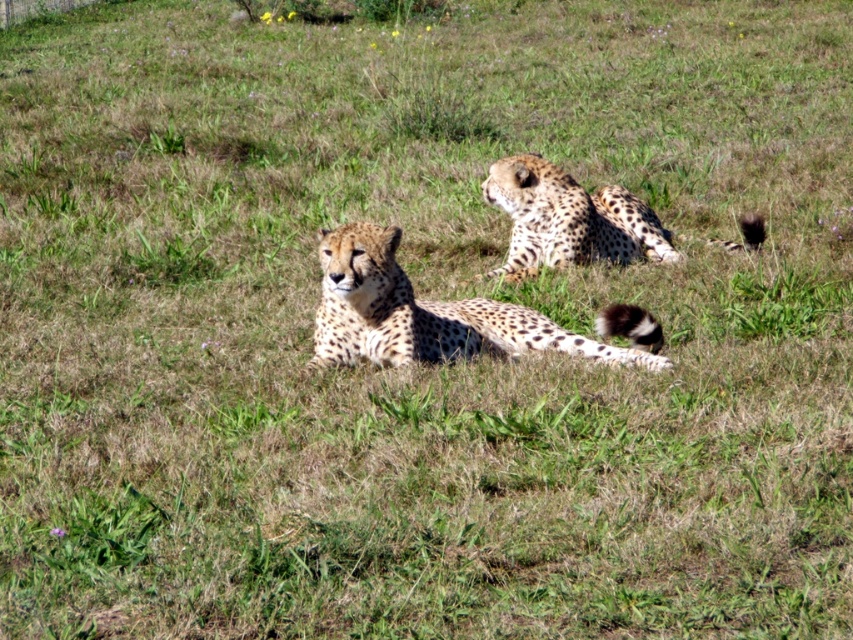
Question: Which point is closer to the camera taking this photo?

Choices:
 (A) (463, 320)
 (B) (494, 168)

Answer: (A)

Question: Does spotted fur cheetah at center have a greater width compared to spotted fur cheetah at upper right?

Choices:
 (A) yes
 (B) no

Answer: (A)

Question: Which point appears closest to the camera in this image?

Choices:
 (A) (323, 310)
 (B) (618, 218)

Answer: (A)

Question: Is spotted fur cheetah at center smaller than spotted fur cheetah at upper right?

Choices:
 (A) yes
 (B) no

Answer: (B)

Question: Which object appears closest to the camera in this image?

Choices:
 (A) spotted fur cheetah at center
 (B) spotted fur cheetah at upper right

Answer: (A)

Question: Observing the image, what is the correct spatial positioning of spotted fur cheetah at center in reference to spotted fur cheetah at upper right?

Choices:
 (A) below
 (B) above

Answer: (A)